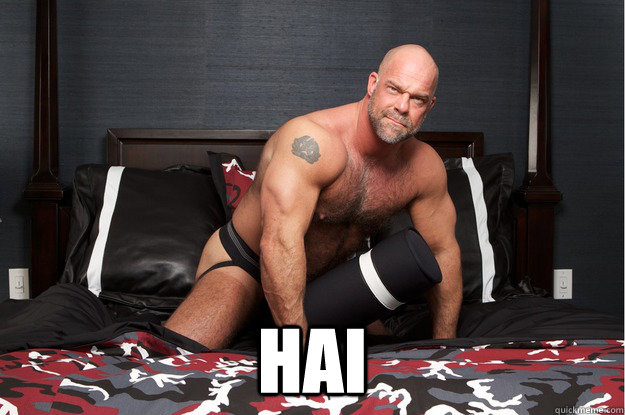
This screenshot has height=415, width=625. In order to click on grey wall in this screenshot , I will do `click(270, 66)`.